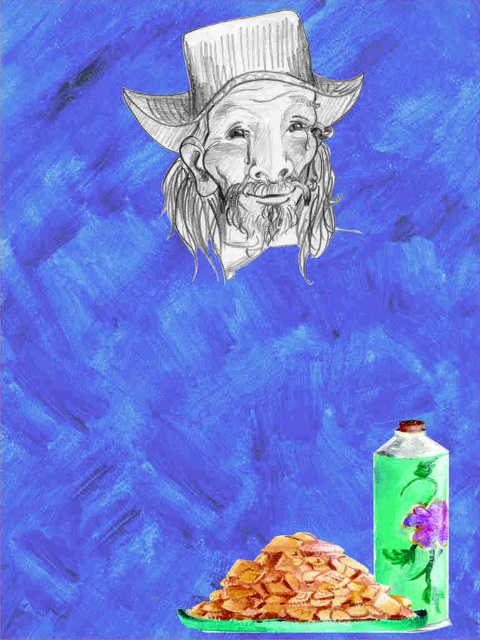
You are an artist holding a 10cm ruler. You need to determine if the graphite pencil cowboy hat at upper center can fit entirely within the space occupied by the golden crispy chips at lower center. Can it?

The graphite pencil cowboy hat at upper center is larger in size compared to the golden crispy chips at lower center, so it cannot fit entirely within the space occupied by the golden crispy chips at lower center.

You are an artist standing in front of a surreal painting. You notice two points marked in the image. The first point is at coordinate point [247,54] and the second point is at coordinate point [325,586]. From your perspective, which point appears closer to you?

Point [325,586] appears closer because point [247,54] is behind it.